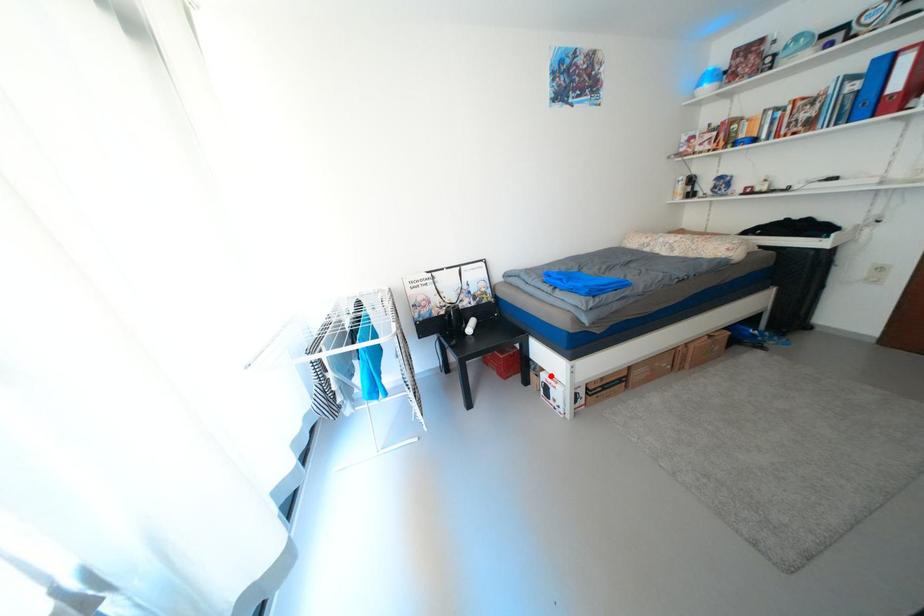
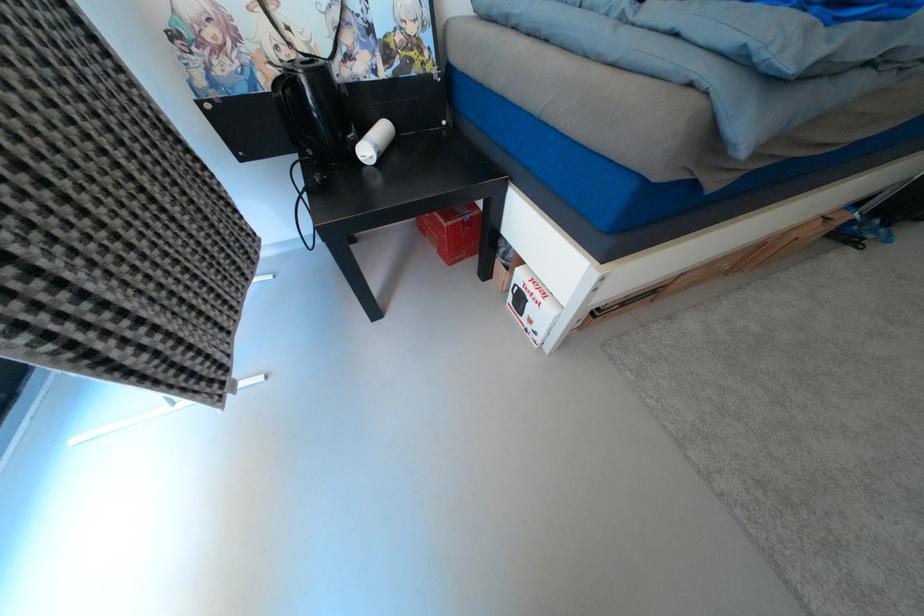
Locate, in the second image, the point that corresponds to the highlighted location in the first image.

(528, 273)